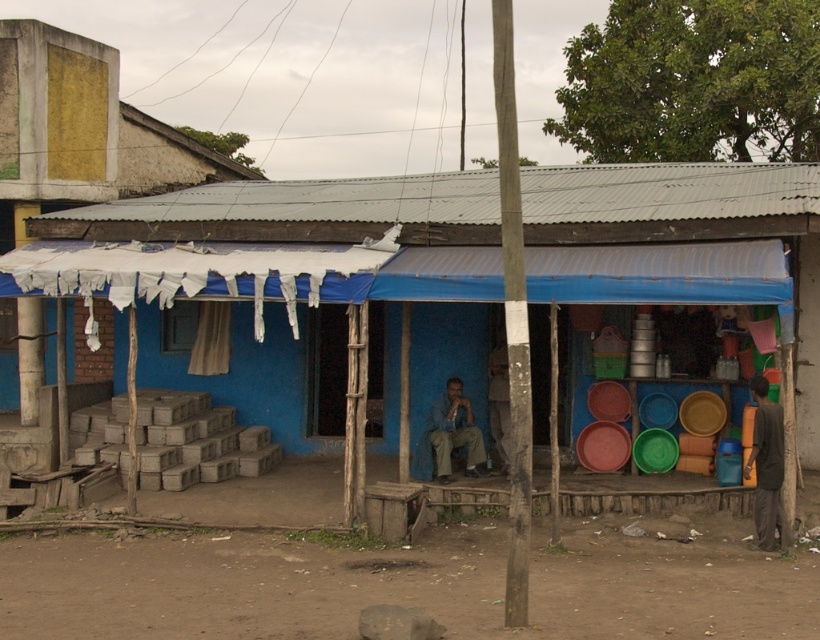
Question: Which point is farther to the camera?

Choices:
 (A) dark gray fabric at lower right
 (B) blue fabric shirt at center
 (C) smooth wooden pole at center

Answer: (B)

Question: Is dark gray fabric at lower right positioned behind blue fabric shirt at center?

Choices:
 (A) yes
 (B) no

Answer: (B)

Question: Which object appears farthest from the camera in this image?

Choices:
 (A) smooth wooden pole at center
 (B) blue painted wood hut at center
 (C) dark gray fabric at lower right

Answer: (C)

Question: Which point is closer to the camera?

Choices:
 (A) blue painted wood hut at center
 (B) blue fabric shirt at center
 (C) smooth wooden pole at center
 (D) dark gray fabric at lower right

Answer: (C)

Question: Is the position of dark gray fabric at lower right less distant than that of blue fabric shirt at center?

Choices:
 (A) no
 (B) yes

Answer: (B)

Question: Does blue painted wood hut at center have a greater width compared to blue fabric shirt at center?

Choices:
 (A) yes
 (B) no

Answer: (A)